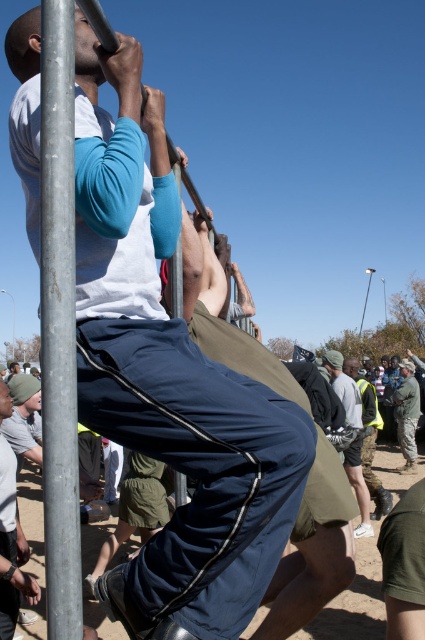
Please observe the image and locate the point at coordinates (343,387). What object is located at this point?

The gray fabric shorts at center is located at point (343,387).

You are a photographer trying to capture the climber with the matte blue track pants at center and the climber with the gray fabric shorts at center. Based on their positions, which climber is higher up on the pole?

The matte blue track pants at center is located above the gray fabric shorts at center, so the climber with the matte blue track pants at center is higher up on the pole.